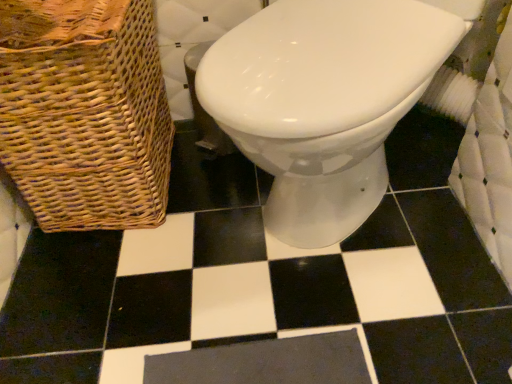
Question: Considering the positions of woven brown basket at left and white glossy toilet at center in the image, is woven brown basket at left wider or thinner than white glossy toilet at center?

Choices:
 (A) wide
 (B) thin

Answer: (B)

Question: From the image's perspective, relative to white glossy toilet at center, is woven brown basket at left above or below?

Choices:
 (A) above
 (B) below

Answer: (A)

Question: Would you say woven brown basket at left is to the left or to the right of white glossy toilet at center in the picture?

Choices:
 (A) left
 (B) right

Answer: (A)

Question: Does point (384, 104) appear closer or farther from the camera than point (160, 192)?

Choices:
 (A) farther
 (B) closer

Answer: (B)

Question: Considering the relative positions of white glossy toilet at center and woven brown basket at left in the image provided, is white glossy toilet at center to the left or to the right of woven brown basket at left?

Choices:
 (A) left
 (B) right

Answer: (B)

Question: Is white glossy toilet at center wider or thinner than woven brown basket at left?

Choices:
 (A) wide
 (B) thin

Answer: (A)

Question: From a real-world perspective, relative to woven brown basket at left, is white glossy toilet at center vertically above or below?

Choices:
 (A) above
 (B) below

Answer: (A)